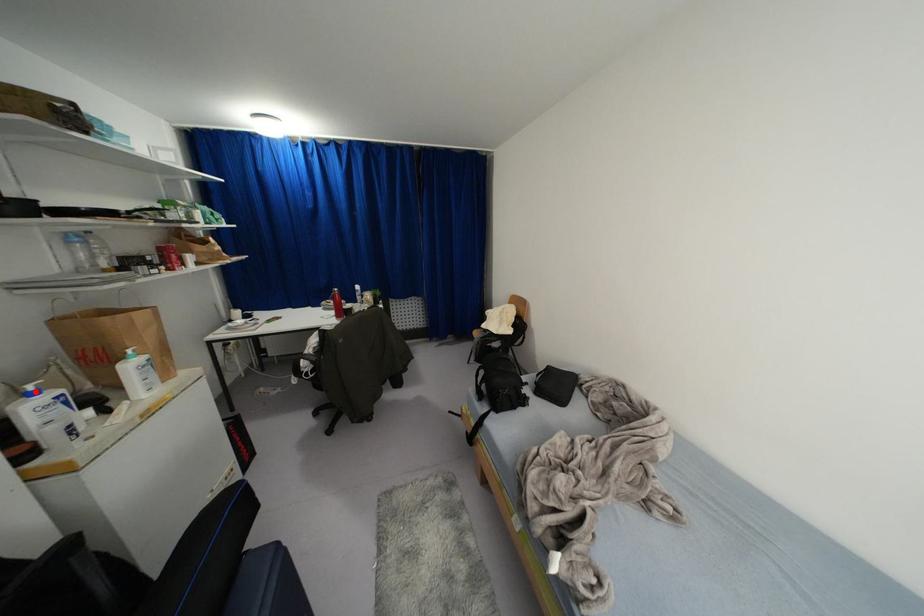
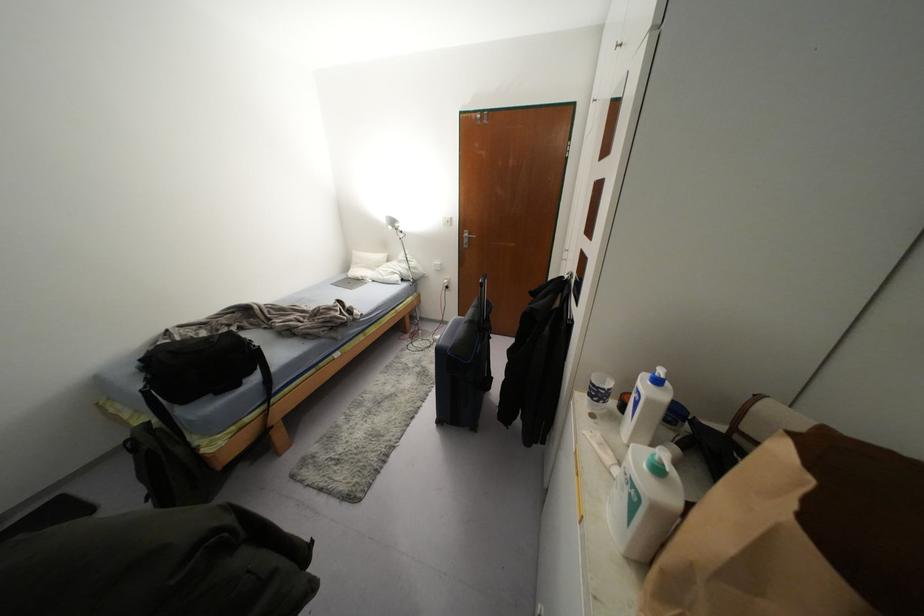
Question: I am providing you with two images of the same scene from different viewpoints. Given a red point in image1, look at the same physical point in image2. Is it:

Choices:
 (A) Closer to the viewpoint
 (B) Farther from the viewpoint

Answer: (A)